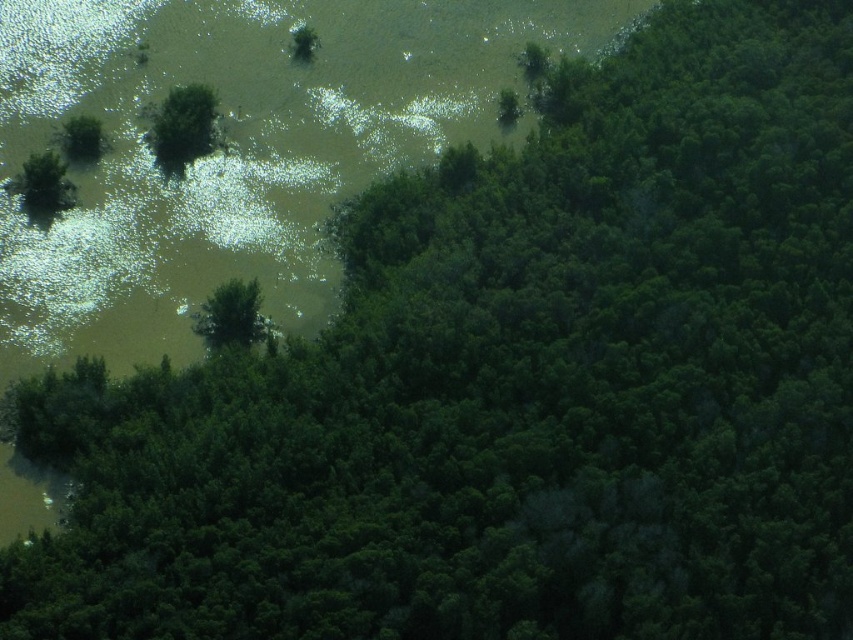
You are a drone operator trying to navigate through this landscape. You need to drop a package at the point marked as point (183, 125). Based on the scene description, what type of terrain will the package land on?

The point (183, 125) is on a green matte tree at upper left, so the package will land on a tree.

You are a hiker trying to navigate through the forest. You see a green matte tree at upper left and a green matte tree at center. Which tree is closer to the edge of the water?

The green matte tree at upper left is positioned on the left side of the green matte tree at center, so the green matte tree at upper left is closer to the edge of the water.

You are a bird flying over the landscape and want to land on the tallest tree. Which tree should you choose between the green matte tree at upper left and the green matte tree at center?

The green matte tree at upper left is taller than the green matte tree at center, so you should choose the green matte tree at upper left to land on.